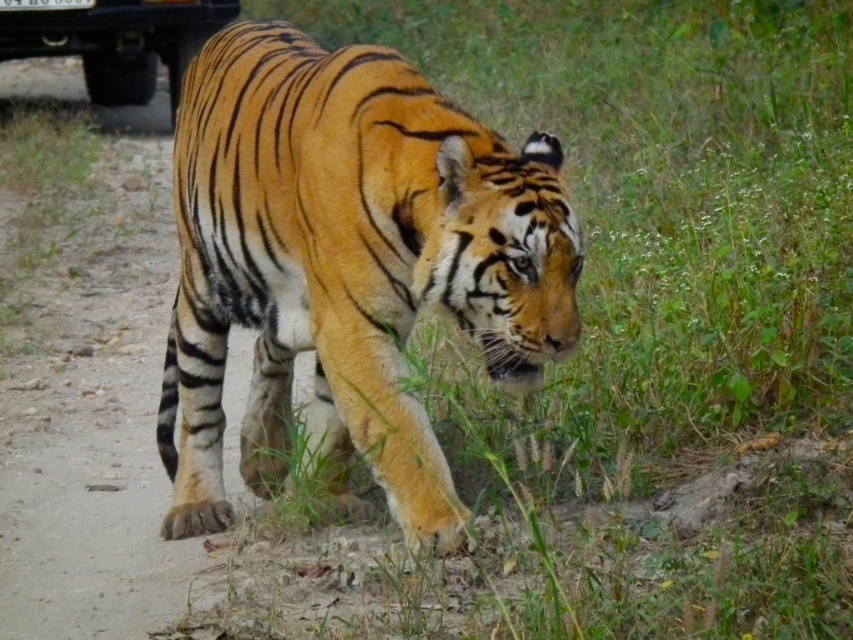
Who is shorter, orange striped tiger at center or metallic black truck at upper left?

metallic black truck at upper left

Is orange striped tiger at center below metallic black truck at upper left?

Correct, orange striped tiger at center is located below metallic black truck at upper left.

Locate an element on the screen. orange striped tiger at center is located at coordinates (346, 266).

At what (x,y) coordinates should I click in order to perform the action: click on orange striped tiger at center. Please return your answer as a coordinate pair (x, y). The width and height of the screenshot is (853, 640). Looking at the image, I should click on 346,266.